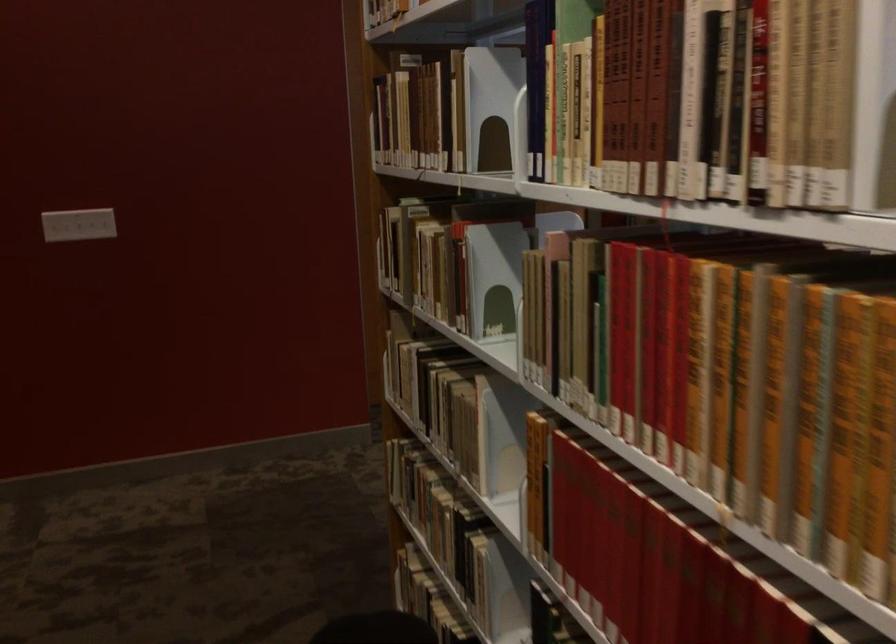
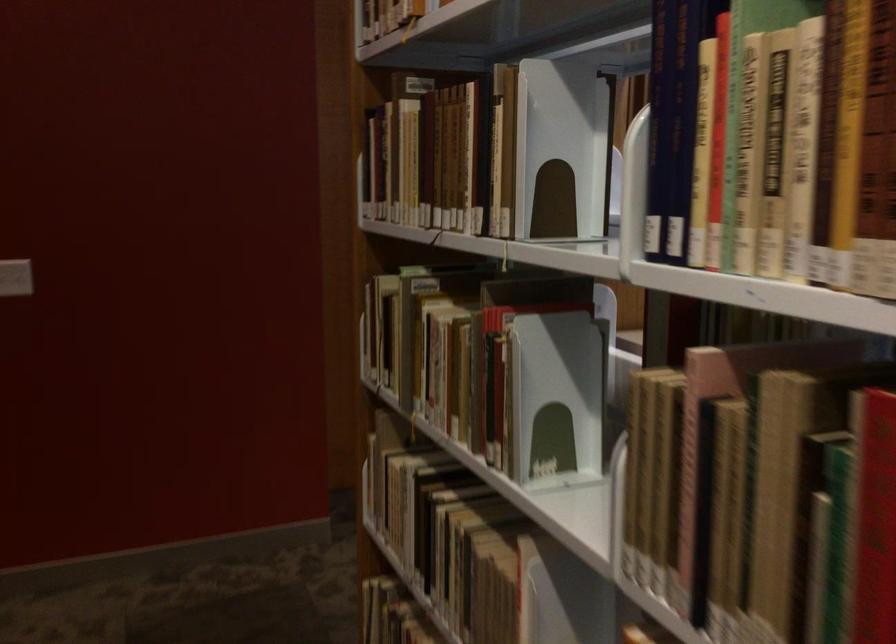
Where in the second image is the point corresponding to (498,109) from the first image?

(561, 149)